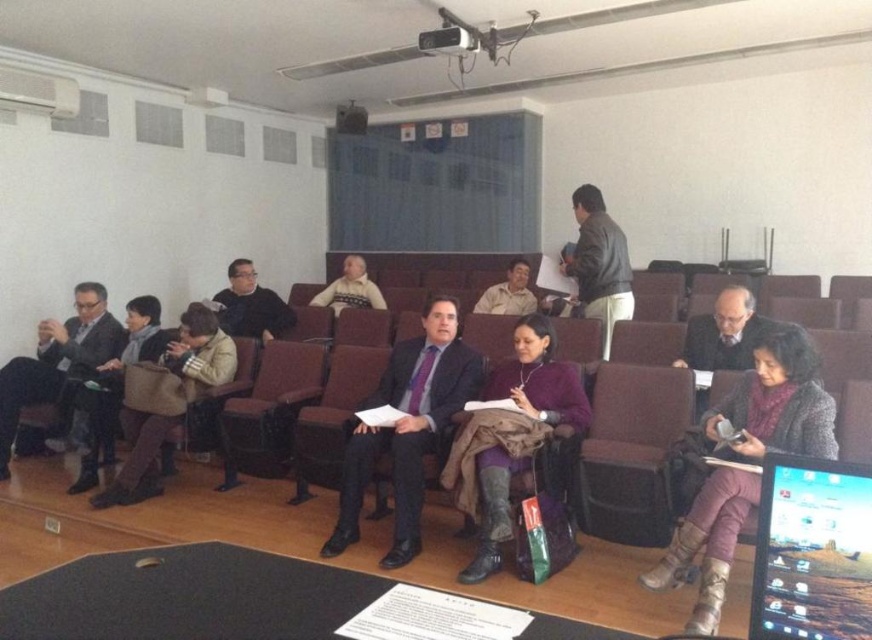
Question: Can you confirm if purple wool scarf at center is bigger than leather jacket at upper center?

Choices:
 (A) yes
 (B) no

Answer: (A)

Question: Is purple soft fabric coat at center positioned behind knitted sweater at center?

Choices:
 (A) no
 (B) yes

Answer: (A)

Question: Which object is farther from the camera taking this photo?

Choices:
 (A) brown fabric chair at center
 (B) brown leather chair at center
 (C) matte black suit at left
 (D) matte black suit at center

Answer: (C)

Question: Does dark brown leather chair at center come in front of matte black jacket at center?

Choices:
 (A) yes
 (B) no

Answer: (A)

Question: Among these objects, which one is farthest from the camera?

Choices:
 (A) matte brown shirt at center
 (B) purple soft fabric coat at center
 (C) brown fabric chair at center

Answer: (A)

Question: Which of these objects is positioned closest to the brown leather jacket at left?

Choices:
 (A) matte black suit at left
 (B) matte brown shirt at center
 (C) knitted sweater at center
 (D) matte black jacket at center

Answer: (A)